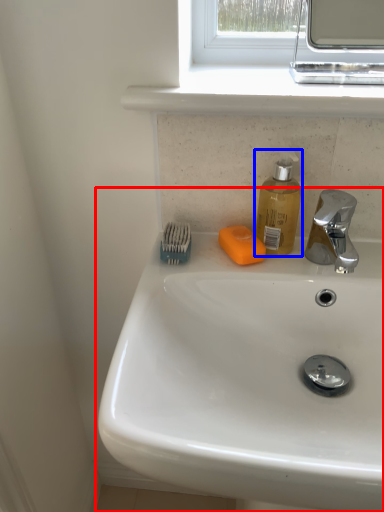
Question: Among these objects, which one is farthest to the camera, sink (highlighted by a red box) or soap dispenser (highlighted by a blue box)?

Choices:
 (A) sink
 (B) soap dispenser

Answer: (B)